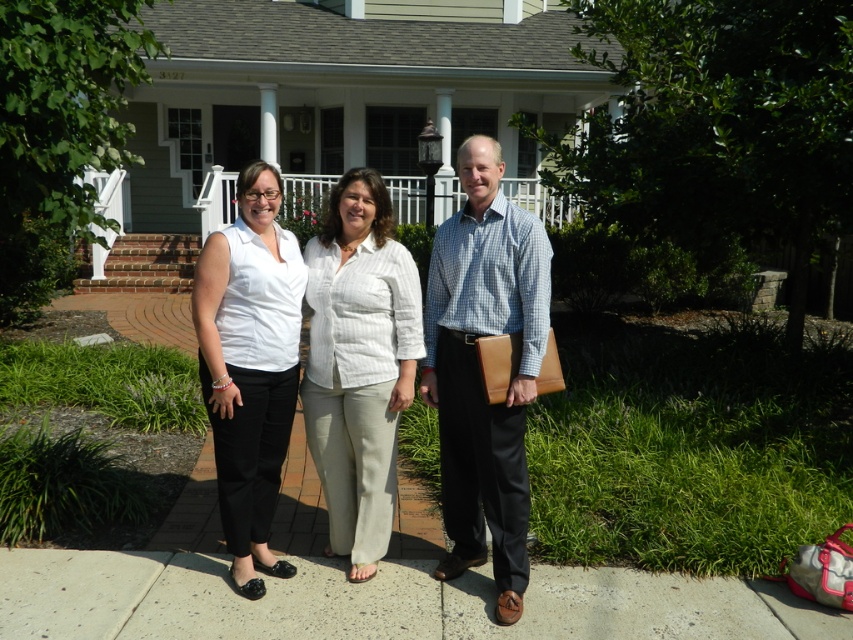
You are planning to place a 1.5 meter wide decorative bench in the scene. Considering the space occupied by the matte white blouse at center and the white wooden porch at center, where would be the best location to place it without overlapping either object?

The best location to place the 1.5 meter wide decorative bench would be near the white wooden porch at center since it has a greater width compared to the matte white blouse at center, providing more space for the bench.

In the scene shown: You are standing in front of the house and want to hand a document to the person wearing the blue checkered shirt at center. Which direction should you move to reach them?

The blue checkered shirt at center is located at point 0.577 on the x and 0.563 on the y axis, so you should move towards the center of the image to reach them.

You are a photographer trying to capture a clear photo of the matte white blouse at center and the white wooden porch at center. Which object will appear larger in the photo?

The matte white blouse at center will appear larger in the photo because it is bigger than the white wooden porch at center according to the description.